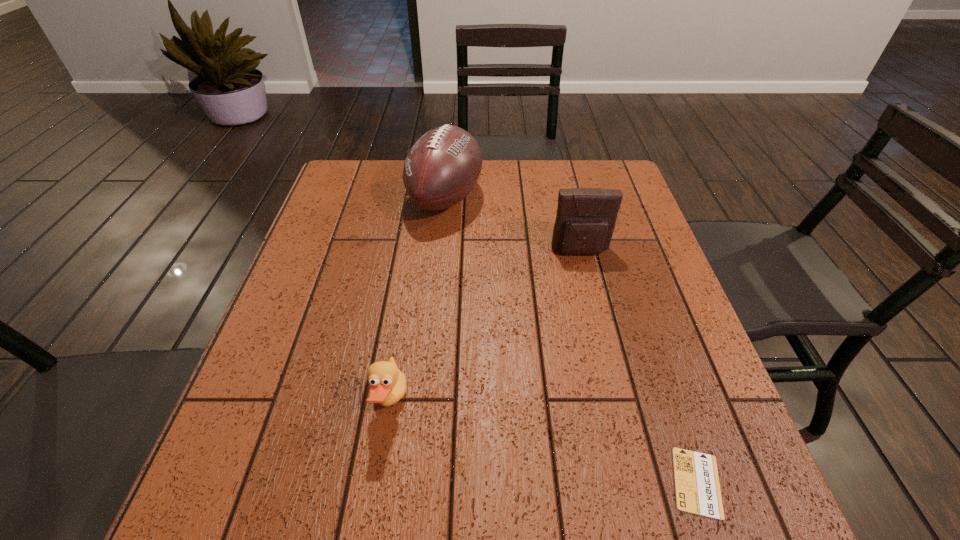
Image resolution: width=960 pixels, height=540 pixels. I want to click on unoccupied position between the nearest object and the third nearest object, so click(638, 367).

Locate an element on the screen. Image resolution: width=960 pixels, height=540 pixels. vacant space that's between the duck and the shortest object is located at coordinates (543, 442).

The image size is (960, 540). I want to click on free spot between the third nearest object and the shortest object, so click(x=638, y=367).

What are the coordinates of `vacant point located between the farthest object and the duck` in the screenshot? It's located at (418, 300).

Choose which object is the third nearest neighbor to the farthest object. Please provide its 2D coordinates. Your answer should be formatted as a tuple, i.e. [(x, y)], where the tuple contains the x and y coordinates of a point satisfying the conditions above.

[(697, 486)]

Where is `object that stands as the second closest to the pouch`? This screenshot has width=960, height=540. object that stands as the second closest to the pouch is located at coordinates (388, 384).

Locate an element on the screen. Image resolution: width=960 pixels, height=540 pixels. vacant space that satisfies the following two spatial constraints: 1. with an open flap on the pouch; 2. on the beak of the duck is located at coordinates (616, 402).

Locate an element on the screen. vacant space that satisfies the following two spatial constraints: 1. on the front side of the tallest object; 2. on the left side of the nearest object is located at coordinates (419, 482).

I want to click on free location that satisfies the following two spatial constraints: 1. on the front side of the farthest object; 2. on the beak of the duck, so click(x=426, y=402).

At what (x,y) coordinates should I click in order to perform the action: click on vacant area that satisfies the following two spatial constraints: 1. on the beak of the duck; 2. on the back side of the nearest object. Please return your answer as a coordinate pair (x, y). The width and height of the screenshot is (960, 540). Looking at the image, I should click on 377,482.